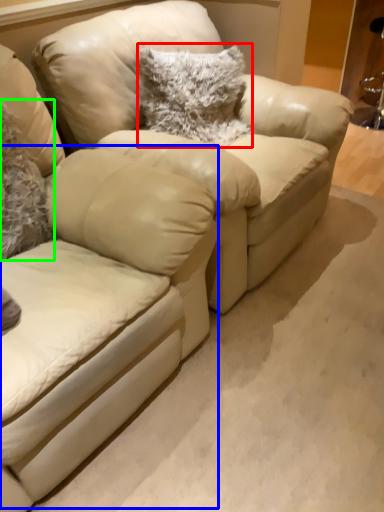
Question: Considering the real-world distances, which object is farthest from pillow (highlighted by a red box)? swivel chair (highlighted by a blue box) or pillow (highlighted by a green box)?

Choices:
 (A) swivel chair
 (B) pillow

Answer: (A)